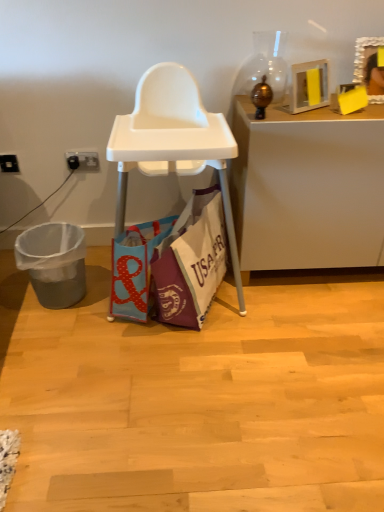
I want to click on vacant area that lies between white glossy desk at upper right and purple fabric bag at center, which is counted as the 1th handbag, starting from the right, so click(x=299, y=308).